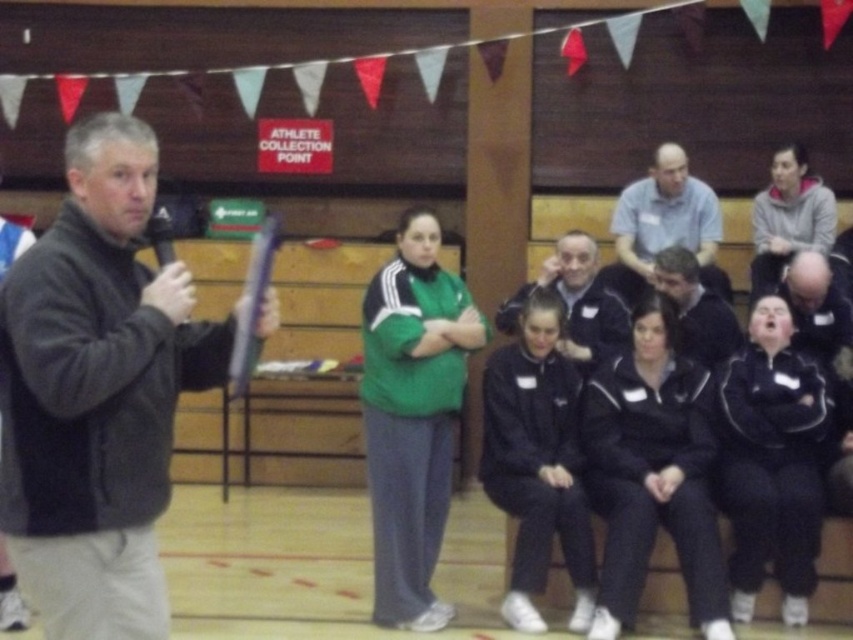
Consider the image. You are a photographer positioned at the back of the sports hall. You want to take a photo that includes both the light blue shirt at upper center and the dark blue jacket at center. Which object should you focus on first if you want to ensure both are in frame?

The light blue shirt at upper center is located above the dark blue jacket at center, so you should focus on the dark blue jacket at center first to ensure both are within the frame.